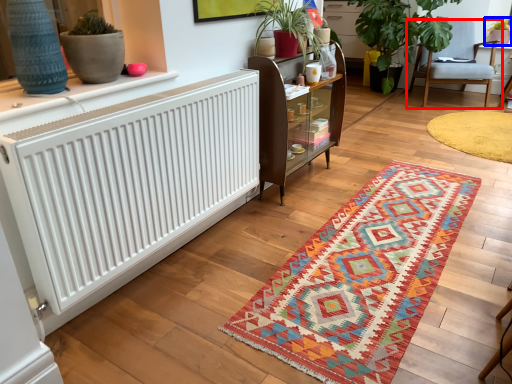
Question: Which object appears farthest to the camera in this image, chair (highlighted by a red box) or houseplant (highlighted by a blue box)?

Choices:
 (A) chair
 (B) houseplant

Answer: (B)